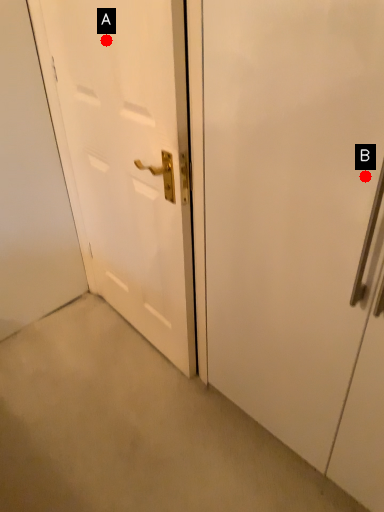
Question: Two points are circled on the image, labeled by A and B beside each circle. Which point is closer to the camera?

Choices:
 (A) A is closer
 (B) B is closer

Answer: (B)